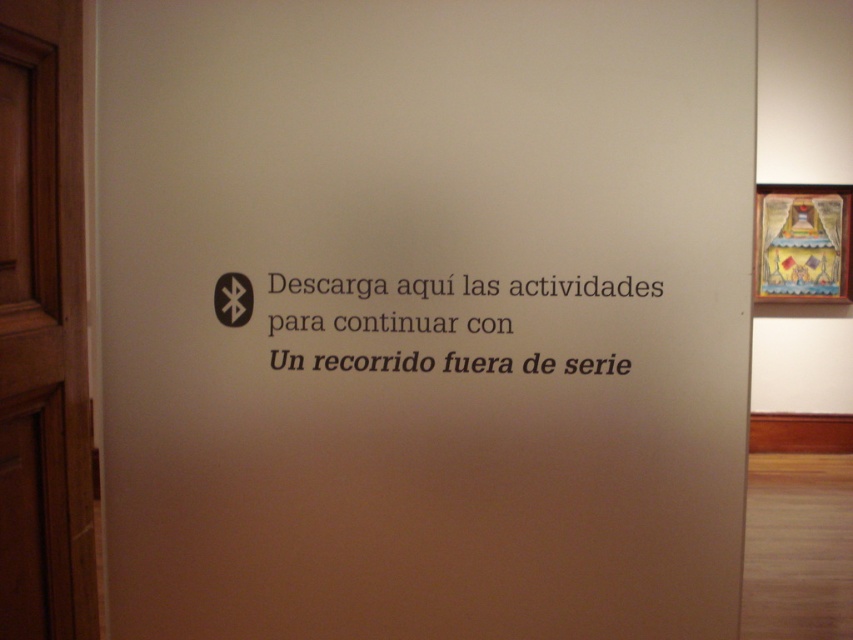
You are standing in front of the wall with the text and need to exit the room. The brown wooden door at left and wooden painted artwork at upper right are visible. Which object is wider?

The brown wooden door at left has a lesser width compared to wooden painted artwork at upper right, so the wooden painted artwork at upper right is wider.

You are standing in a museum and see the brown wooden door at left and the black paper text at center. Which object is positioned to the left of the other?

The brown wooden door at left is to the left of black paper text at center.

You are standing in front of a wall with two points marked. The first point is at coordinates point (18,524) and the second is at point (801,269). Which point is closer to you?

Point (18,524) is closer to you because it is in front of point (801,269).